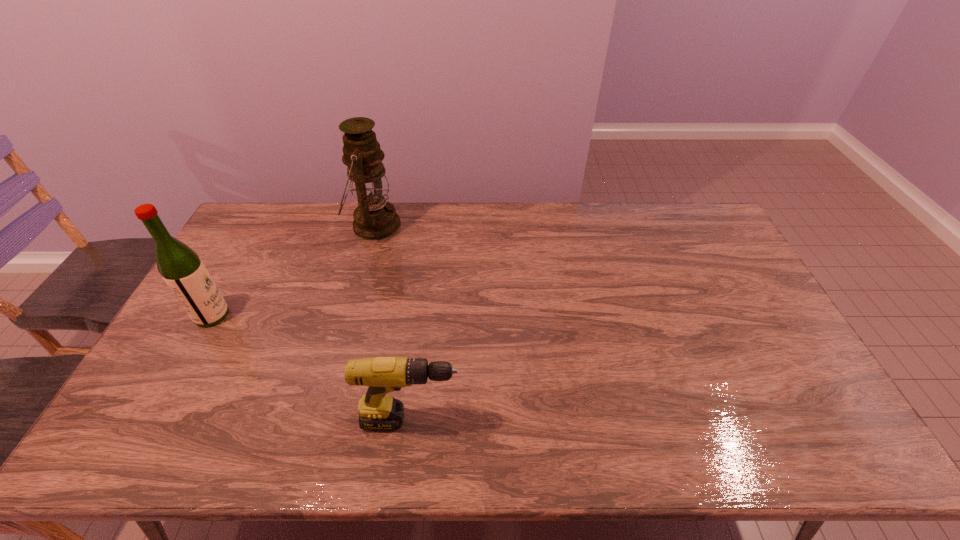
Locate an element on the screen. The height and width of the screenshot is (540, 960). object present at the near edge is located at coordinates (378, 411).

Find the location of a particular element. object at the left edge is located at coordinates (183, 271).

I want to click on vacant region at the far edge, so click(x=544, y=232).

This screenshot has height=540, width=960. I want to click on free space at the near edge of the desktop, so click(x=591, y=460).

In the image, there is a desktop. Where is `vacant space at the left edge`? The width and height of the screenshot is (960, 540). vacant space at the left edge is located at coordinates (248, 260).

Where is `vacant space at the far left corner of the desktop`? This screenshot has width=960, height=540. vacant space at the far left corner of the desktop is located at coordinates pos(259,210).

Identify the location of empty location between the second object from right to left and the second nearest object. (293, 271).

You are a GUI agent. You are given a task and a screenshot of the screen. Output one action in this format:
    pyautogui.click(x=<x>, y=<y>)
    Task: Click on the vacant area between the farthest object and the liquor
    Image resolution: width=960 pixels, height=540 pixels.
    Given the screenshot: What is the action you would take?
    pyautogui.click(x=293, y=271)

At what (x,y) coordinates should I click in order to perform the action: click on free space that is in between the liquor and the oil lamp. Please return your answer as a coordinate pair (x, y). The width and height of the screenshot is (960, 540). Looking at the image, I should click on (293, 271).

Where is `vacant space in between the oil lamp and the leftmost object`? vacant space in between the oil lamp and the leftmost object is located at coordinates (293, 271).